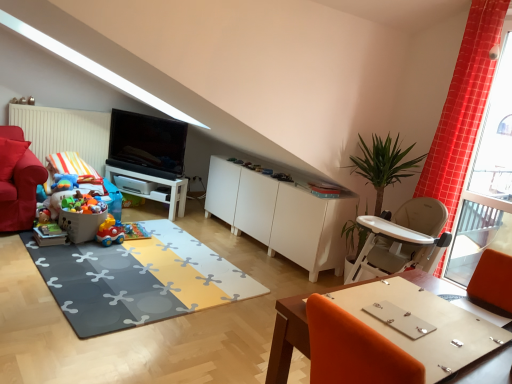
At what (x,y) coordinates should I click in order to perform the action: click on free space to the right of plastic matte car at center, which is counted as the third toy, starting from the top. Please return your answer as a coordinate pair (x, y). Looking at the image, I should click on (130, 244).